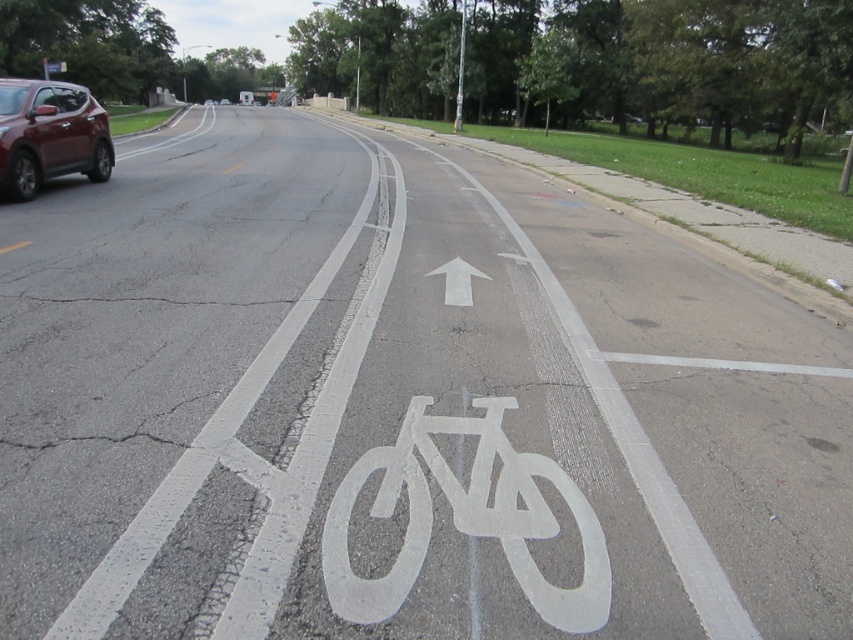
You are standing on the sidewalk and see the white painted bicycle at center in the bike lane. If you want to cross the road to reach the other side, will you need to step into the bike lane to get to the bicycle?

The white painted bicycle at center is 1.78 meters away from the viewer, so you would need to step into the bike lane to reach it since it is located in the bike lane area.

You are a cyclist planning to ride through the bike lane. There is a point marked at coordinates (465, 516). Where is this point located in relation to the white painted bicycle at center?

The point at coordinates (465, 516) corresponds to the white painted bicycle at center, so it is located exactly at the center of the bicycle symbol.

You are a cyclist planning to ride through the bike lane. You notice the white painted bicycle at center and the matte red suv at left. Which object takes up less space in the image?

The white painted bicycle at center takes up less space in the image because it is smaller than the matte red suv at left.